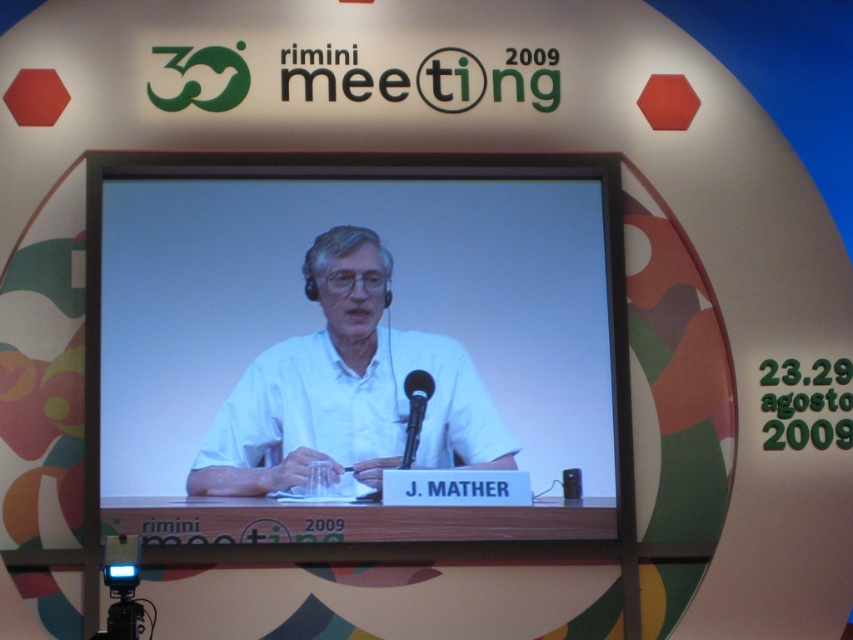
You are an event organizer at the Rimini Meeting 2009. You need to adjust the camera angle to focus on both the white matte shirt at center and the black metallic microphone at center. Which object should you move the camera towards first to ensure both are in frame?

The white matte shirt at center is to the left of the black metallic microphone at center. To ensure both are in frame, you should move the camera towards the white matte shirt at center first, then adjust to include the black metallic microphone at center.

You are attending the Rimini Meeting 2009 and notice the presenter wearing a white matte shirt at center and holding a black metallic microphone at center. Which object is taller when viewed from the audience perspective?

The white matte shirt at center is taller than the black metallic microphone at center.